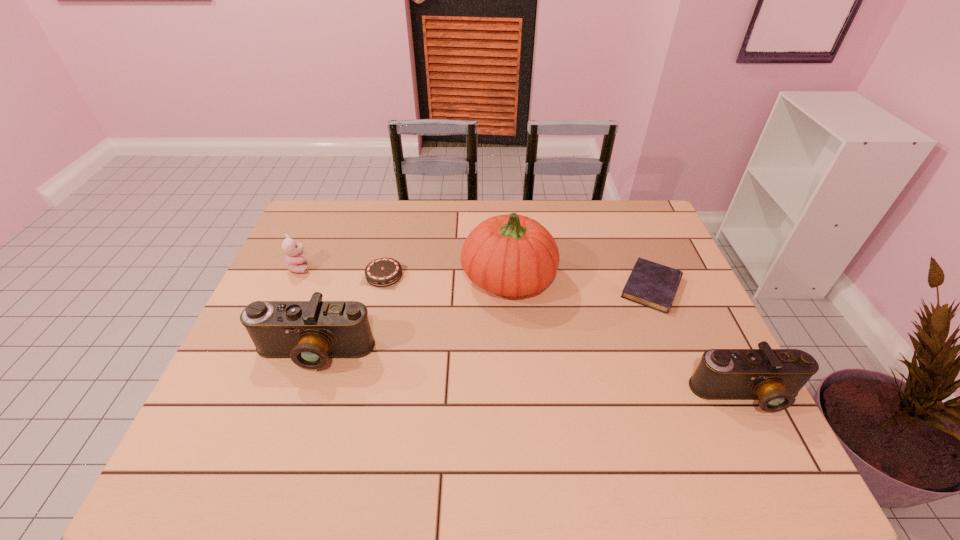
To make them evenly spaced by inserting another camera among them, please locate a vacant spot for this new camera. Please provide its 2D coordinates. Your answer should be formatted as a tuple, i.e. [(x, y)], where the tuple contains the x and y coordinates of a point satisfying the conditions above.

[(521, 373)]